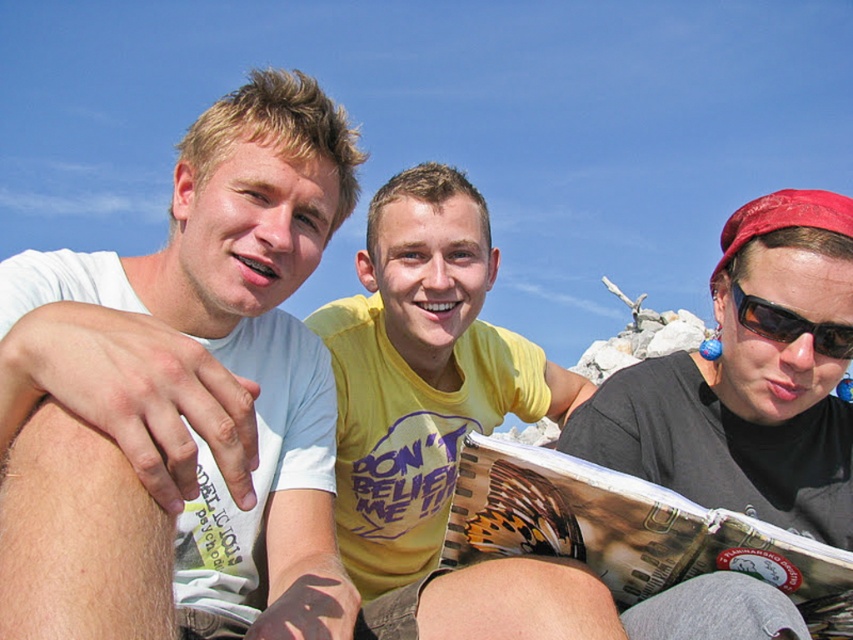
You are standing at the point labeled point (816, 337) and want to walk to the point labeled point (497, 484). Which direction should you face to move towards your destination?

You should face forward because point (497, 484) is in front of point (816, 337).